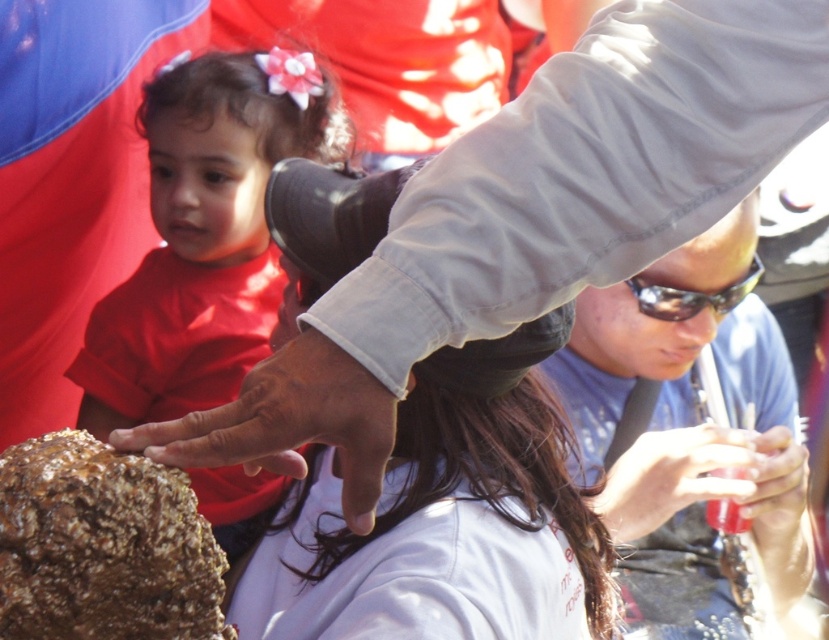
Does sunglasses at upper center lie in front of smooth plastic cup at lower right?

Yes, sunglasses at upper center is in front of smooth plastic cup at lower right.

Is sunglasses at upper center taller than smooth plastic cup at lower right?

In fact, sunglasses at upper center may be shorter than smooth plastic cup at lower right.

Between point (757, 282) and point (709, 509), which one is positioned behind?

Point (709, 509)

I want to click on sunglasses at upper center, so click(x=691, y=296).

Can you confirm if translucent plastic cup at lower right is taller than sunglasses at upper center?

Indeed, translucent plastic cup at lower right has a greater height compared to sunglasses at upper center.

What do you see at coordinates (676, 476) in the screenshot? This screenshot has width=829, height=640. I see `translucent plastic cup at lower right` at bounding box center [676, 476].

Locate an element on the screen. The image size is (829, 640). translucent plastic cup at lower right is located at coordinates (676, 476).

Does sunglasses at center have a greater width compared to brown rough rock at center?

Yes, sunglasses at center is wider than brown rough rock at center.

Where is `sunglasses at center`? The width and height of the screenshot is (829, 640). sunglasses at center is located at coordinates (687, 429).

Is point (789, 598) in front of point (114, 509)?

No, (789, 598) is further to viewer.

At what (x,y) coordinates should I click in order to perform the action: click on sunglasses at center. Please return your answer as a coordinate pair (x, y). The height and width of the screenshot is (640, 829). Looking at the image, I should click on (687, 429).